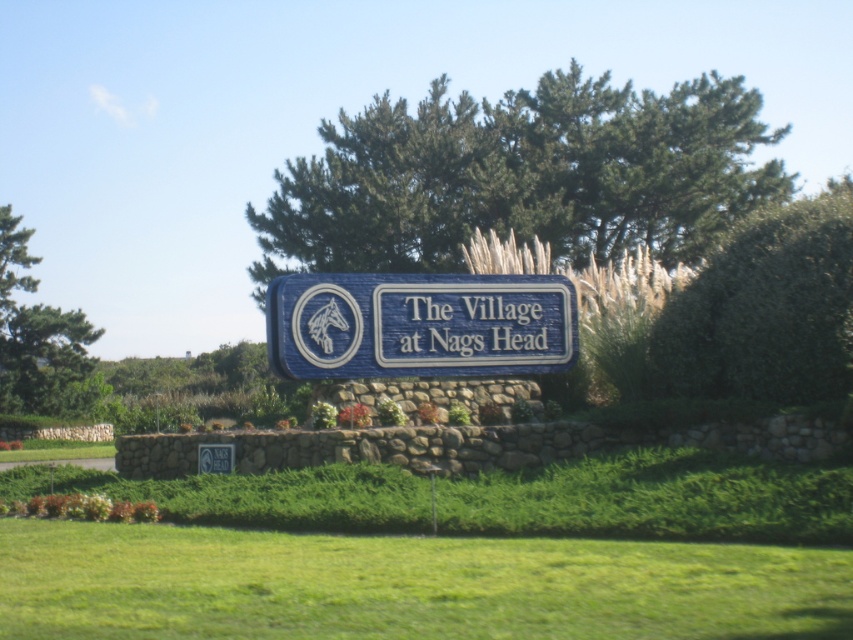
Question: Estimate the real-world distances between objects in this image. Which object is farther from the green leafy bush at center right?

Choices:
 (A) green leafy tree at left
 (B) green leafy tree at center

Answer: (A)

Question: Which of the following is the closest to the observer?

Choices:
 (A) green leafy tree at center
 (B) blue wooden sign at center

Answer: (B)

Question: Which object is the farthest from the green leafy tree at left?

Choices:
 (A) green leafy tree at center
 (B) blue wooden sign at center

Answer: (B)

Question: Where is green leafy bush at center right located in relation to green leafy tree at left in the image?

Choices:
 (A) above
 (B) below

Answer: (A)

Question: Is green leafy tree at center smaller than green leafy bush at center right?

Choices:
 (A) no
 (B) yes

Answer: (A)

Question: In this image, where is green leafy bush at center right located relative to green leafy tree at left?

Choices:
 (A) left
 (B) right

Answer: (B)